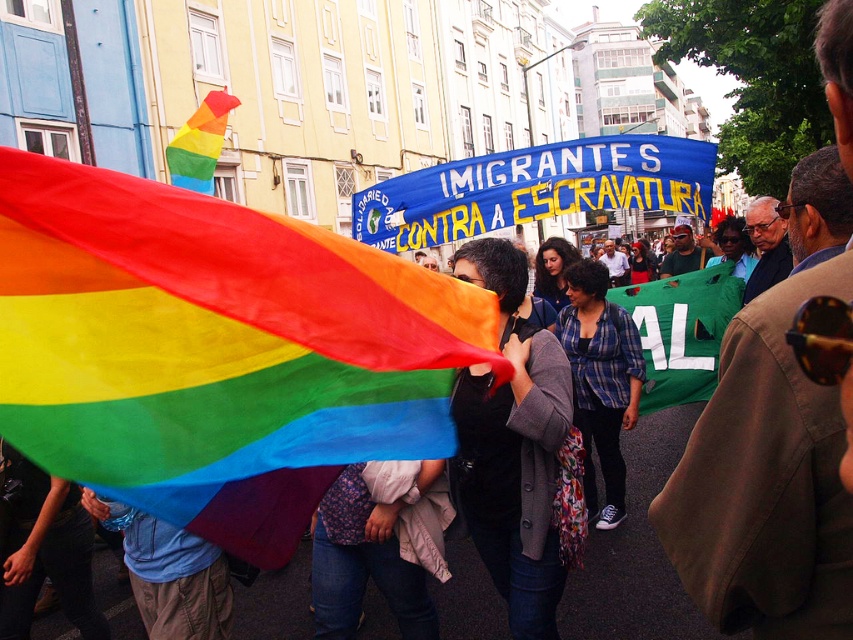
Question: Which object is positioned farthest from the matte black jacket at center?

Choices:
 (A) green fabric banner at center
 (B) rainbow fabric flag at center
 (C) blue plaid shirt at center

Answer: (B)

Question: Which object appears farthest from the camera in this image?

Choices:
 (A) rainbow fabric flag at upper left
 (B) rainbow fabric flag at center
 (C) matte black jacket at center

Answer: (A)

Question: Is matte black jacket at center closer to the viewer compared to green fabric banner at center?

Choices:
 (A) yes
 (B) no

Answer: (A)

Question: Does rainbow fabric flag at center have a smaller size compared to green fabric banner at center?

Choices:
 (A) yes
 (B) no

Answer: (A)

Question: Among these points, which one is nearest to the camera?

Choices:
 (A) (692, 364)
 (B) (635, 355)
 (C) (549, 369)
 (D) (22, 161)

Answer: (D)

Question: Where is blue plaid shirt at center located in relation to denim pants at lower left in the image?

Choices:
 (A) below
 (B) above

Answer: (B)